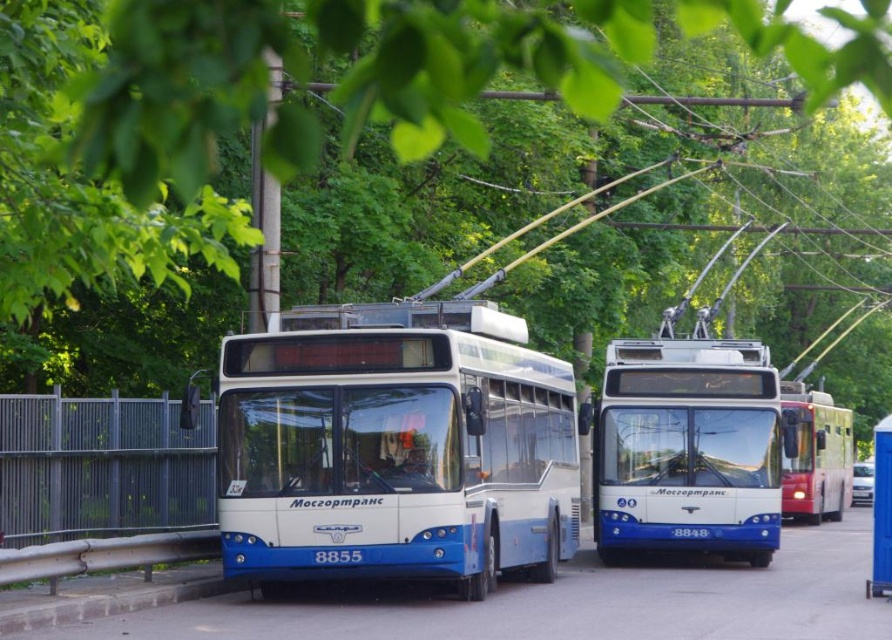
You are standing at the point marked by the coordinate point (687, 449), which is the location of the blue glossy trolleybus at center. You want to walk towards the nearest tree. Which direction should you go?

The blue glossy trolleybus at center is located at point (687, 449). Since the nearest tree is to the north of this point, you should walk north to reach it.

Based on the photo, you are a delivery person who needs to load a package onto the roof of the blue metallic bus at center. The package is 2 meters tall. Considering the space between the bus and the blue plastic bus stop at lower right, can you safely lift the package onto the roof without hitting anything?

The blue metallic bus at center is not as tall as the blue plastic bus stop at lower right, so the height clearance between them is sufficient. Therefore, you can safely lift the package onto the roof of the blue metallic bus at center without hitting the blue plastic bus stop at lower right.

You are a delivery person who needs to park your 2.5 meter wide van between the blue glossy trolleybus at center and the red glossy trolleybus at right. Based on the scene, can your van fit in the space between them?

The blue glossy trolleybus at center is narrower than the red glossy trolleybus at right, but the exact distance between them isn